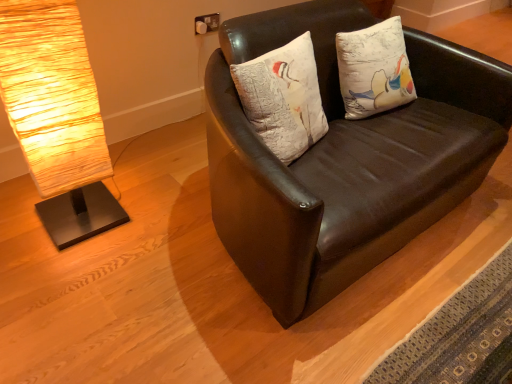
This screenshot has width=512, height=384. I want to click on unoccupied space behind rustic wood lamp at left, so click(128, 180).